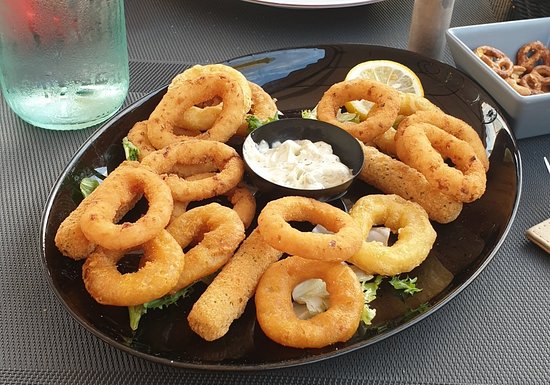
You are a GUI agent. You are given a task and a screenshot of the screen. Output one action in this format:
    pyautogui.click(x=<x>, y=<y>)
    Task: Click on the glass
    The image size is (550, 385).
    Given the screenshot: What is the action you would take?
    pyautogui.click(x=82, y=51)